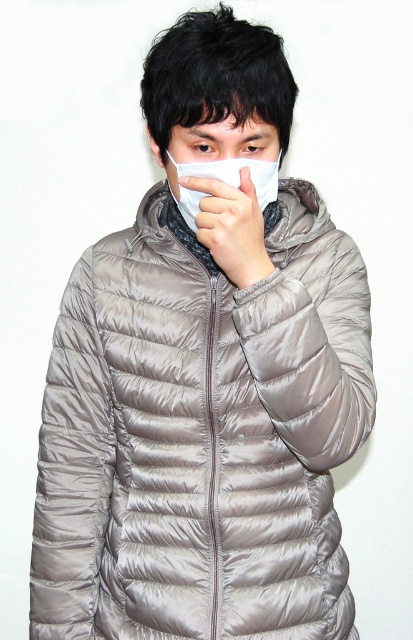
Does matte gray glove at center have a larger size compared to white matte handkerchief at center?

Incorrect, matte gray glove at center is not larger than white matte handkerchief at center.

Consider the image. Can you confirm if matte gray glove at center is positioned to the right of white matte handkerchief at center?

Indeed, matte gray glove at center is positioned on the right side of white matte handkerchief at center.

Image resolution: width=413 pixels, height=640 pixels. I want to click on matte gray glove at center, so click(x=232, y=227).

Locate an element on the screen. matte gray glove at center is located at coordinates (232, 227).

Does point (239, 243) come closer to viewer compared to point (228, 147)?

Yes.

Does matte gray glove at center have a lesser width compared to matte white nose at center?

No.

Where is `matte gray glove at center`? This screenshot has width=413, height=640. matte gray glove at center is located at coordinates (232, 227).

Can you confirm if matte gray glove at center is thinner than white matte mask at center?

Indeed, matte gray glove at center has a lesser width compared to white matte mask at center.

Who is more distant from viewer, (272, 269) or (246, 144)?

The point (246, 144) is behind.

Is point (225, 236) positioned behind point (230, 128)?

No, it is in front of (230, 128).

You are a GUI agent. You are given a task and a screenshot of the screen. Output one action in this format:
    pyautogui.click(x=<x>, y=<y>)
    Task: Click on the matte gray glove at center
    The height and width of the screenshot is (640, 413).
    Given the screenshot: What is the action you would take?
    pyautogui.click(x=232, y=227)